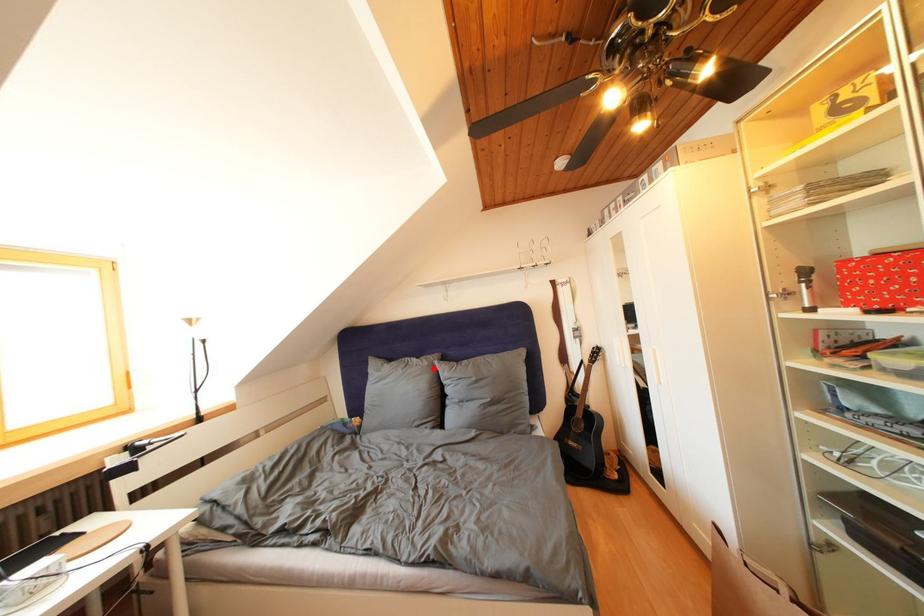
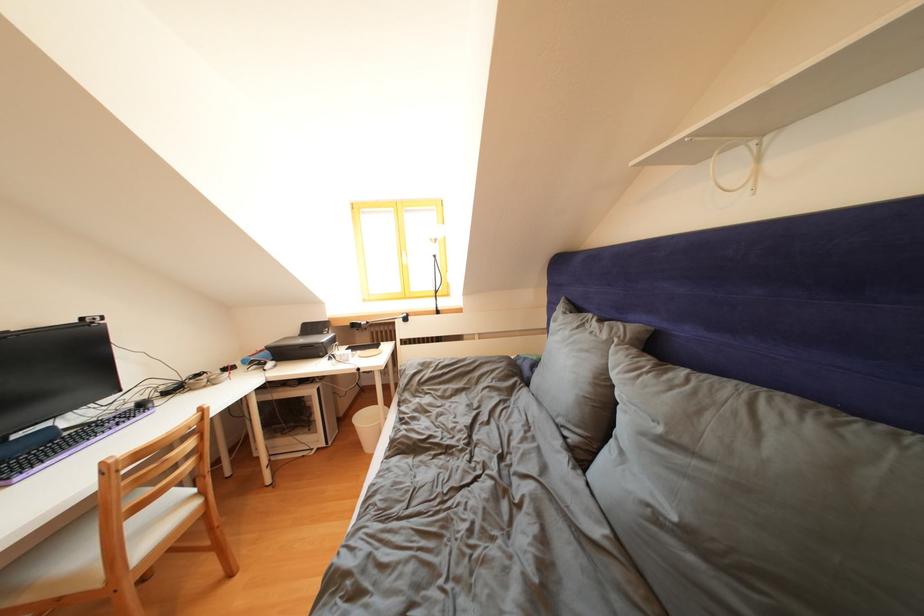
The point at the highlighted location is marked in the first image. Where is the corresponding point in the second image?

(612, 341)